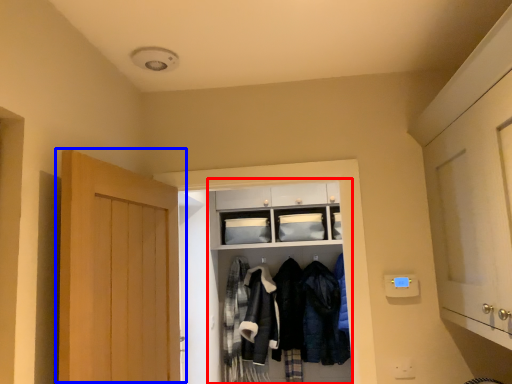
Question: Which object appears farthest to the camera in this image, closet (highlighted by a red box) or door (highlighted by a blue box)?

Choices:
 (A) closet
 (B) door

Answer: (A)